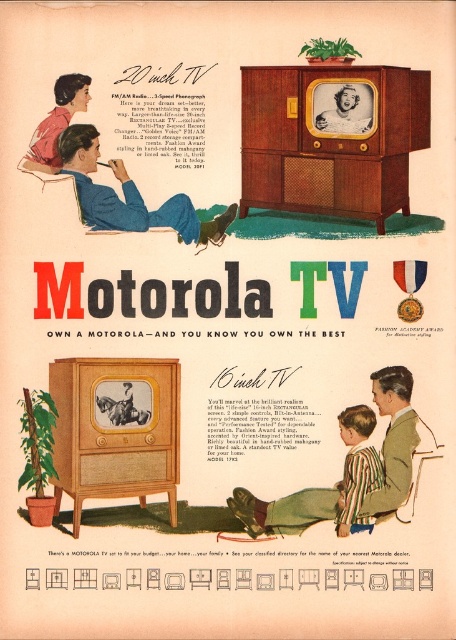
Can you confirm if blue fabric jacket at upper left is smaller than matte pink blouse at upper left?

Actually, blue fabric jacket at upper left might be larger than matte pink blouse at upper left.

Between blue fabric jacket at upper left and matte pink blouse at upper left, which one has less height?

Standing shorter between the two is matte pink blouse at upper left.

Is point (138, 225) less distant than point (84, 102)?

No.

Find the location of a particular element. This screenshot has height=640, width=456. blue fabric jacket at upper left is located at coordinates (129, 195).

Is the position of striped fabric shirt at lower center less distant than that of blue fabric jacket at upper left?

Yes, striped fabric shirt at lower center is in front of blue fabric jacket at upper left.

Which is more to the right, striped fabric shirt at lower center or blue fabric jacket at upper left?

striped fabric shirt at lower center

What do you see at coordinates (350, 468) in the screenshot? I see `striped fabric shirt at lower center` at bounding box center [350, 468].

Where is `striped fabric shirt at lower center`? striped fabric shirt at lower center is located at coordinates (350, 468).

Does striped fabric shirt at lower center come behind striped fabric shirt at lower right?

No, it is in front of striped fabric shirt at lower right.

Is striped fabric shirt at lower center in front of striped fabric shirt at lower right?

Yes, striped fabric shirt at lower center is closer to the viewer.

Between point (378, 492) and point (343, 493), which one is positioned behind?

Positioned behind is point (343, 493).

What are the coordinates of `striped fabric shirt at lower center` in the screenshot? It's located at (350, 468).